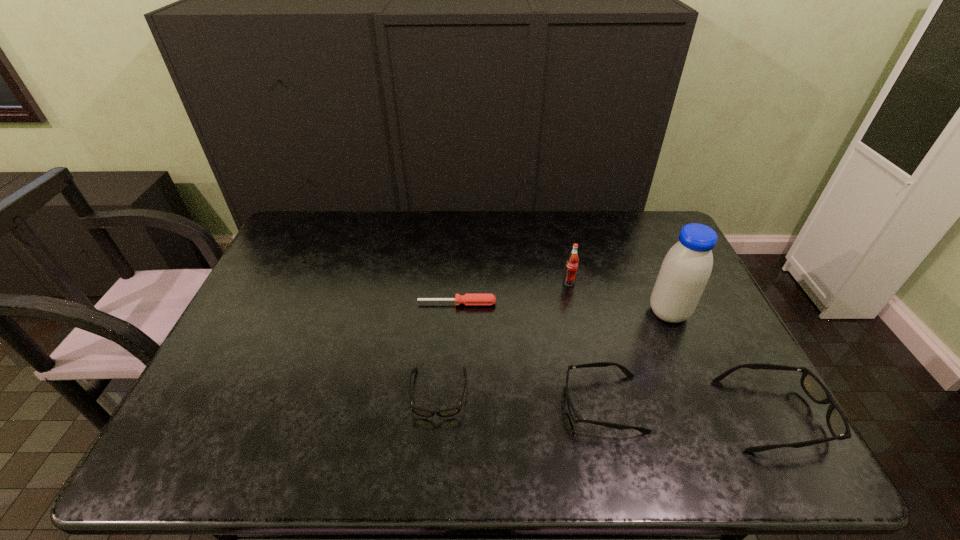
Where is `free space located on the front-facing side of the second spectacles from right to left`? The width and height of the screenshot is (960, 540). free space located on the front-facing side of the second spectacles from right to left is located at coordinates (398, 404).

Where is `vacant space located on the front-facing side of the second spectacles from right to left`? vacant space located on the front-facing side of the second spectacles from right to left is located at coordinates pos(468,404).

Find the location of a particular element. vacant space situated on the front-facing side of the second spectacles from right to left is located at coordinates (468, 404).

In order to click on vacant point located on the back of the soya milk in this screenshot , I will do `click(632, 228)`.

The width and height of the screenshot is (960, 540). Identify the location of vacant space situated on the label of the soda bottle. (581, 336).

What are the coordinates of `vacant space positioned 0.100m on the back of the shortest object` in the screenshot? It's located at (458, 278).

Identify the location of spectacles present at the right edge. The height and width of the screenshot is (540, 960). (838, 426).

Locate an element on the screen. This screenshot has height=540, width=960. soya milk positioned at the right edge is located at coordinates (686, 268).

Where is `object at the near right corner`? object at the near right corner is located at coordinates (838, 426).

This screenshot has height=540, width=960. I want to click on free point at the far edge, so click(350, 240).